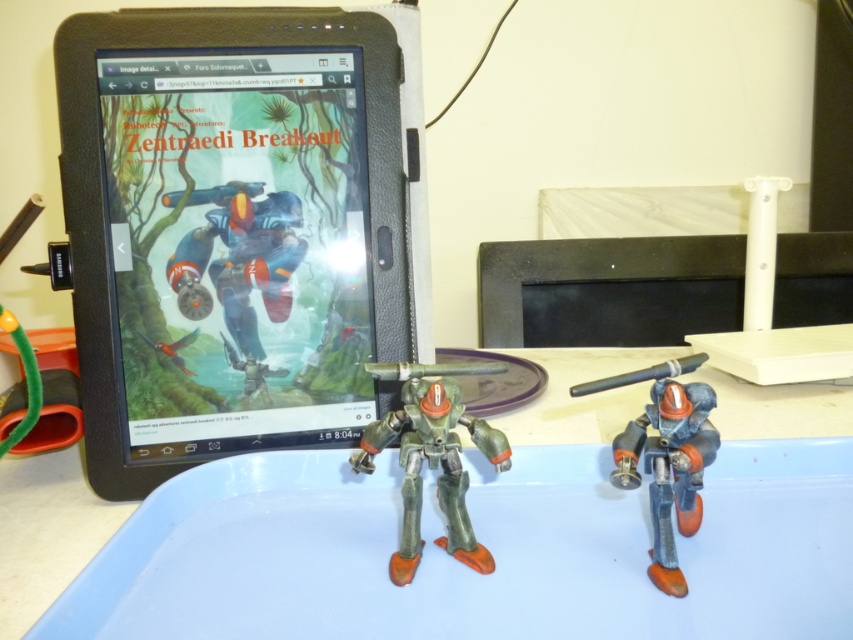
Question: Which point is closer to the camera?

Choices:
 (A) (407, 353)
 (B) (128, 509)
 (C) (378, 422)

Answer: (C)

Question: Can you confirm if black matte tablet at upper left is smaller than matte plastic robot at center?

Choices:
 (A) yes
 (B) no

Answer: (B)

Question: Is black matte tablet at upper left positioned behind green matte robot at center?

Choices:
 (A) yes
 (B) no

Answer: (A)

Question: Considering the real-world distances, which object is farthest from the matte plastic robot at center?

Choices:
 (A) green matte robot at center
 (B) blue plastic tray at center
 (C) black matte tablet at upper left

Answer: (C)

Question: Considering the real-world distances, which object is closest to the black matte tablet at upper left?

Choices:
 (A) blue plastic tray at center
 (B) green matte robot at center
 (C) matte plastic robot at center

Answer: (B)

Question: Observing the image, what is the correct spatial positioning of black matte tablet at upper left in reference to green matte robot at center?

Choices:
 (A) below
 (B) above

Answer: (B)